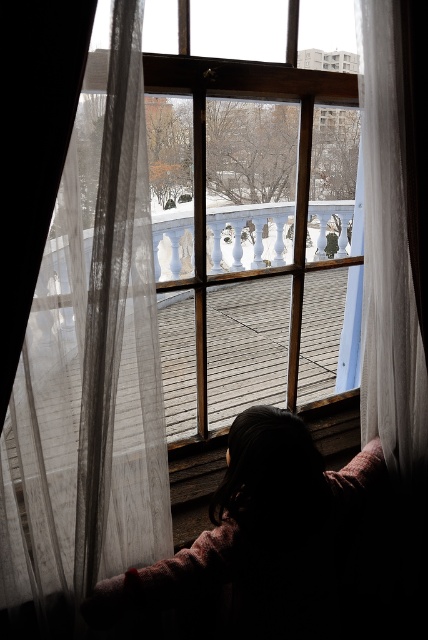
Is point (133, 80) positioned before point (300, 500)?

That is True.

Is point (21, 372) positioned behind point (350, 513)?

No, (21, 372) is closer to viewer.

You are a GUI agent. You are given a task and a screenshot of the screen. Output one action in this format:
    pyautogui.click(x=<x>, y=<y>)
    Task: Click on the sheer white curtain at left
    The width and height of the screenshot is (428, 640).
    Given the screenshot: What is the action you would take?
    pyautogui.click(x=89, y=371)

Which is above, silky pink sweater at lower center or translucent fabric curtain at right?

translucent fabric curtain at right is above.

Describe the element at coordinates (261, 538) in the screenshot. I see `silky pink sweater at lower center` at that location.

In order to click on silky pink sweater at lower center in this screenshot , I will do `click(261, 538)`.

Does sheer white curtain at left appear on the right side of translucent fabric curtain at right?

No, sheer white curtain at left is not to the right of translucent fabric curtain at right.

Does point (89, 518) come in front of point (383, 230)?

Yes, point (89, 518) is closer to viewer.

Who is more forward, [77,467] or [391,196]?

Point [77,467] is in front.

Image resolution: width=428 pixels, height=640 pixels. Find the location of `sheer white curtain at left`. sheer white curtain at left is located at coordinates (89, 371).